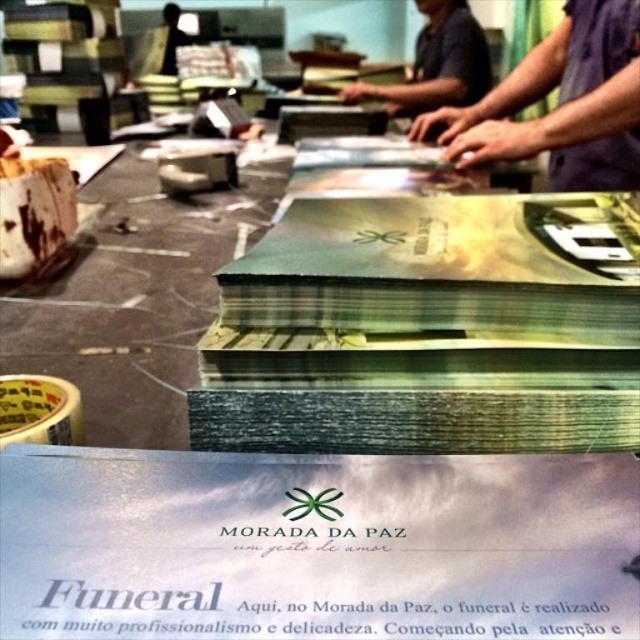
You are an employee in this printing office and need to find a specific document. You see the purple sleeveless shirt at upper right and the dark blue shirt at upper center. Which shirt is positioned lower in the image?

The purple sleeveless shirt at upper right is located below the dark blue shirt at upper center, so it is positioned lower in the image.

Based on the photo, what is located at the point with coordinates (561, 104) in the image?

The purple sleeveless shirt at upper right is located at the point with coordinates (561, 104) in the image.

You are an assistant organizing a funeral service and need to place a name tag on the purple sleeveless shirt at upper right and the black fabric at upper left. Which object should you place the name tag closer to the bottom of the scene?

The purple sleeveless shirt at upper right is located below the black fabric at upper left, so you should place the name tag closer to the bottom of the scene on the purple sleeveless shirt at upper right.